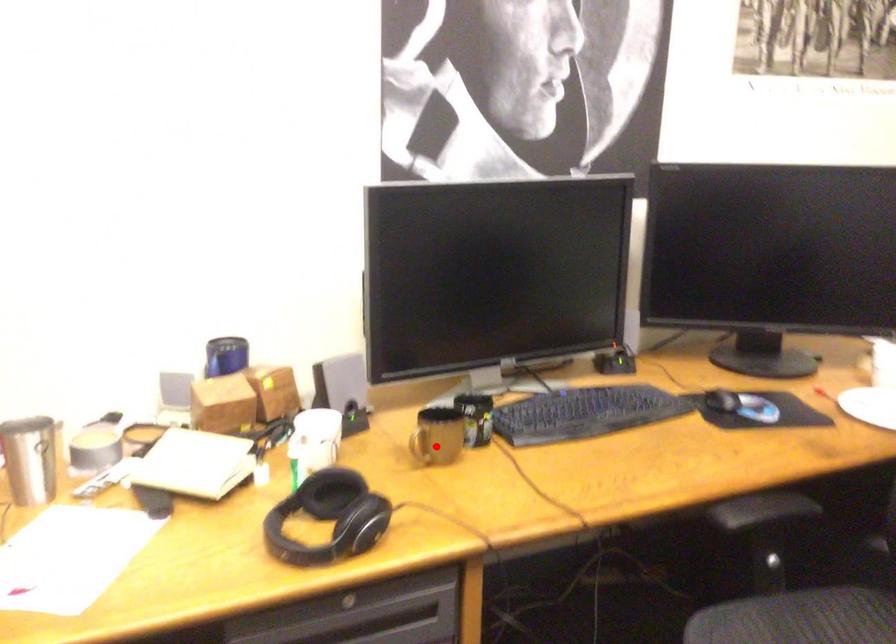
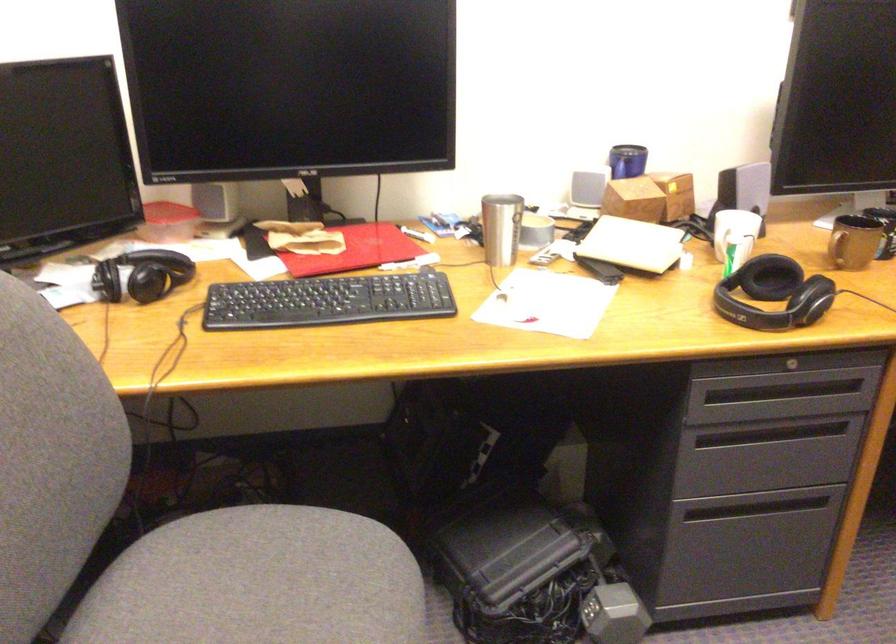
Question: I am providing you with two images of the same scene from different viewpoints. A red point is marked on the first image. At the location where the point appears in image 1, is it still visible in image 2?

Choices:
 (A) Yes
 (B) No

Answer: (A)